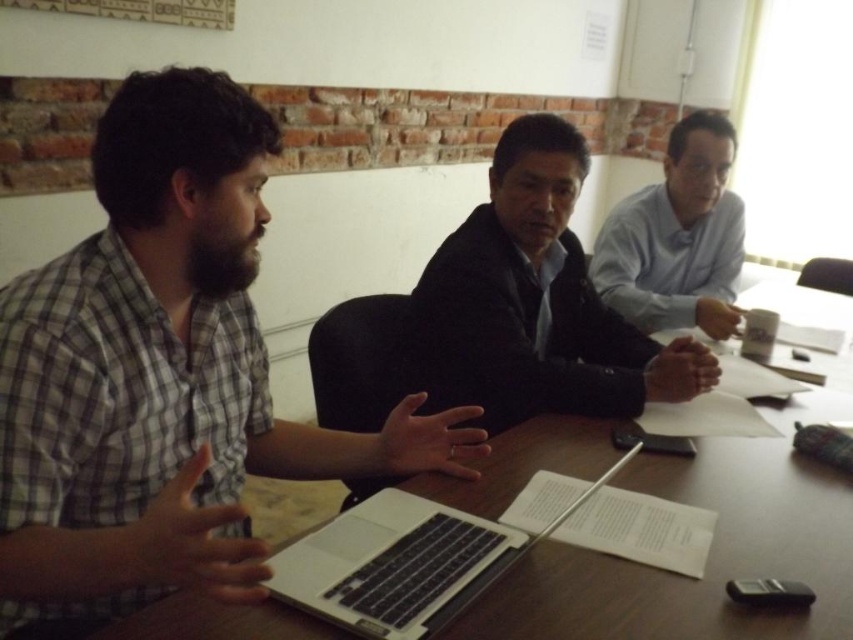
Question: Does wooden table at center appear under white glossy shirt at upper right?

Choices:
 (A) no
 (B) yes

Answer: (B)

Question: Which of the following is the closest to the observer?

Choices:
 (A) (387, 572)
 (B) (154, 548)

Answer: (B)

Question: Does wooden table at center appear on the left side of black suit at center?

Choices:
 (A) yes
 (B) no

Answer: (B)

Question: Is silver/black keyboard at center in front of white glossy shirt at upper right?

Choices:
 (A) yes
 (B) no

Answer: (A)

Question: Which point appears closest to the camera in this image?

Choices:
 (A) (564, 220)
 (B) (561, 612)
 (C) (688, 276)
 (D) (213, 163)

Answer: (B)

Question: Which object is closer to the camera taking this photo?

Choices:
 (A) black suit at center
 (B) silver/black keyboard at center
 (C) matte black laptop at left

Answer: (C)